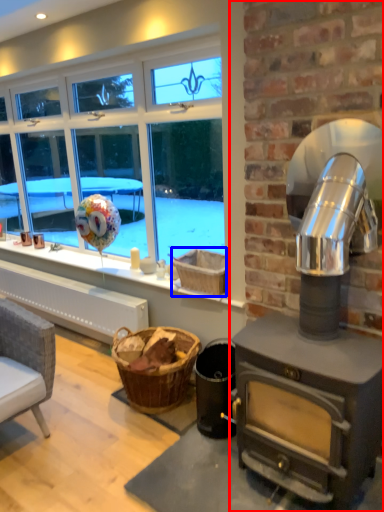
Question: Which point is further to the camera, fireplace (highlighted by a red box) or basket (highlighted by a blue box)?

Choices:
 (A) fireplace
 (B) basket

Answer: (B)